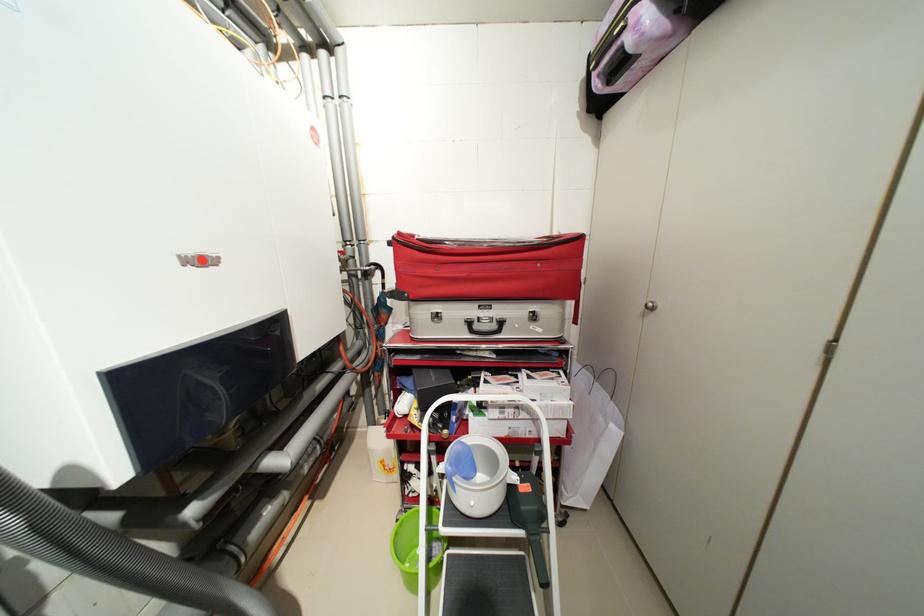
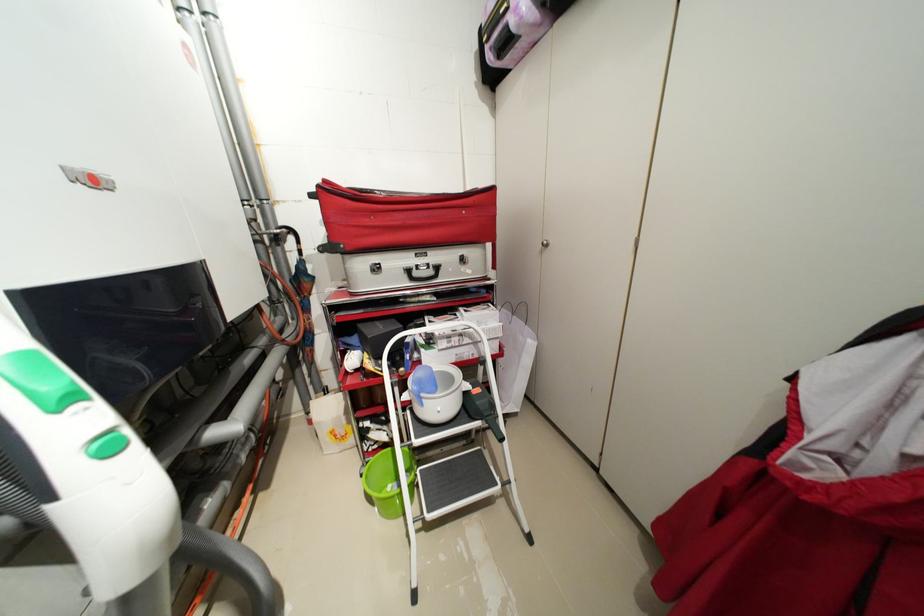
Find the pixel in the second image that matches point (535, 488) in the first image.

(484, 391)